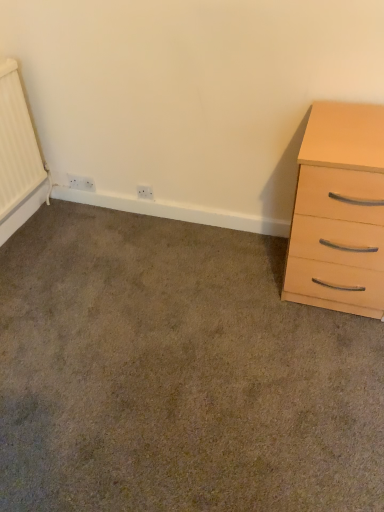
The width and height of the screenshot is (384, 512). Find the location of `vacant area that lies in front of light wood/veneer chest of drawers at right`. vacant area that lies in front of light wood/veneer chest of drawers at right is located at coordinates (325, 358).